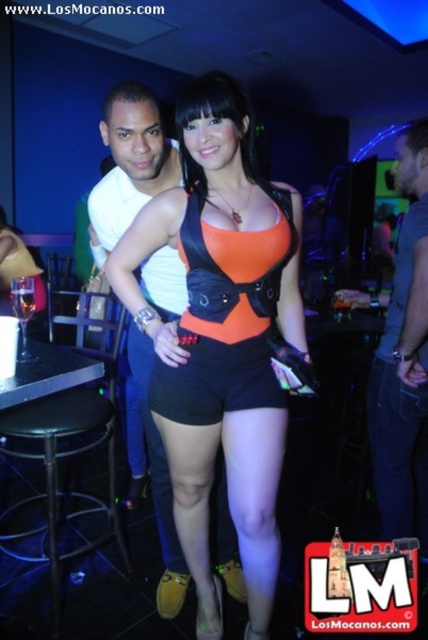
In the scene shown: Does orange matte tank top at center have a smaller size compared to clear glass at bar left?

No, orange matte tank top at center is not smaller than clear glass at bar left.

Is orange matte tank top at center below clear glass at bar left?

Yes, orange matte tank top at center is below clear glass at bar left.

The image size is (428, 640). I want to click on orange matte tank top at center, so click(x=220, y=339).

Who is more distant from viewer, (409,284) or (79,512)?

Positioned behind is point (79,512).

Is gray cotton shirt at center below black metal bar stool at lower left?

No.

Does point (371, 451) come closer to viewer compared to point (44, 406)?

No, it is not.

In order to click on gray cotton shirt at center in this screenshot , I will do `click(403, 358)`.

Can you confirm if orange matte tank top at center is shorter than gray cotton shirt at center?

Yes, orange matte tank top at center is shorter than gray cotton shirt at center.

Does orange matte tank top at center lie behind gray cotton shirt at center?

No, orange matte tank top at center is closer to the viewer.

Is point (162, 352) less distant than point (419, 508)?

That is True.

Where is `orange matte tank top at center`? Image resolution: width=428 pixels, height=640 pixels. orange matte tank top at center is located at coordinates (220, 339).